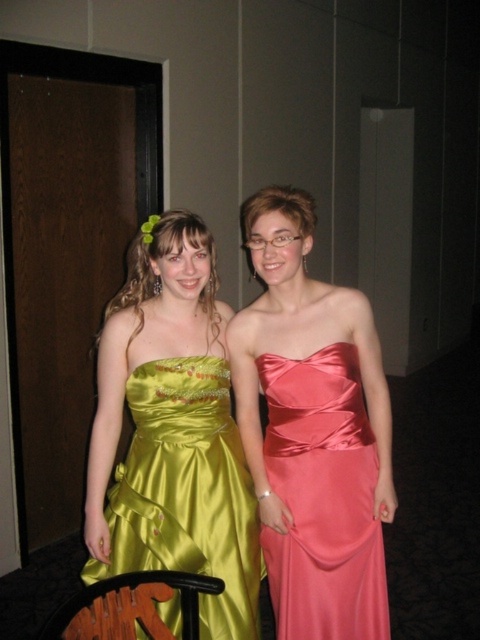
Does point (101, 577) lie behind point (290, 365)?

Yes.

Between point (204, 573) and point (323, 520), which one is positioned in front?

Point (323, 520) is more forward.

Identify the location of green satin dress at left. (187, 492).